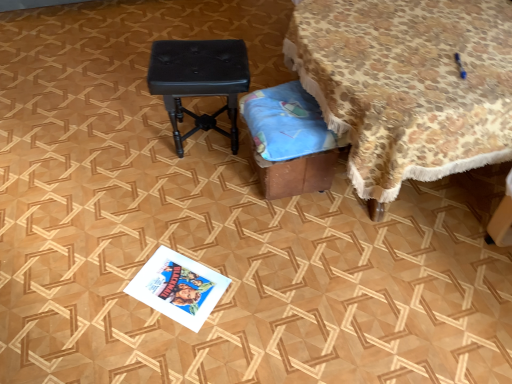
Question: Can you confirm if black leather stool at center is positioned to the right of brown cardboard box at lower center?

Choices:
 (A) no
 (B) yes

Answer: (A)

Question: Can you confirm if black leather stool at center is wider than brown cardboard box at lower center?

Choices:
 (A) no
 (B) yes

Answer: (B)

Question: Can you confirm if black leather stool at center is positioned to the left of brown cardboard box at lower center?

Choices:
 (A) no
 (B) yes

Answer: (B)

Question: Can you confirm if black leather stool at center is shorter than brown cardboard box at lower center?

Choices:
 (A) no
 (B) yes

Answer: (A)

Question: Is brown cardboard box at lower center located within black leather stool at center?

Choices:
 (A) yes
 (B) no

Answer: (B)

Question: From a real-world perspective, relative to floral fabric-covered table at upper right, is black leather stool at center vertically above or below?

Choices:
 (A) below
 (B) above

Answer: (A)

Question: From their relative heights in the image, would you say black leather stool at center is taller or shorter than floral fabric-covered table at upper right?

Choices:
 (A) short
 (B) tall

Answer: (A)

Question: Is point click(x=228, y=87) closer or farther from the camera than point click(x=505, y=99)?

Choices:
 (A) closer
 (B) farther

Answer: (B)

Question: In terms of size, does black leather stool at center appear bigger or smaller than floral fabric-covered table at upper right?

Choices:
 (A) big
 (B) small

Answer: (B)

Question: Choose the correct answer: Is white glossy magazine at lower center inside black leather stool at center or outside it?

Choices:
 (A) outside
 (B) inside

Answer: (A)

Question: Considering their positions, is white glossy magazine at lower center located in front of or behind black leather stool at center?

Choices:
 (A) behind
 (B) front

Answer: (B)

Question: Looking at their shapes, would you say white glossy magazine at lower center is wider or thinner than black leather stool at center?

Choices:
 (A) wide
 (B) thin

Answer: (B)

Question: From the image's perspective, is white glossy magazine at lower center located above or below black leather stool at center?

Choices:
 (A) below
 (B) above

Answer: (A)

Question: From the image's perspective, relative to black leather stool at center, is floral fabric-covered table at upper right above or below?

Choices:
 (A) below
 (B) above

Answer: (B)

Question: Visually, is floral fabric-covered table at upper right positioned to the left or to the right of black leather stool at center?

Choices:
 (A) left
 (B) right

Answer: (B)